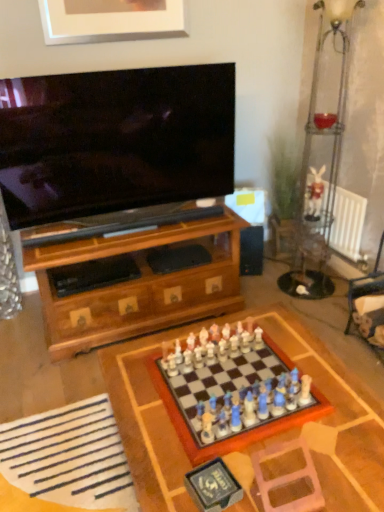
This screenshot has height=512, width=384. What are the coordinates of `vacant location behind white fabric at lower left` in the screenshot? It's located at (53, 384).